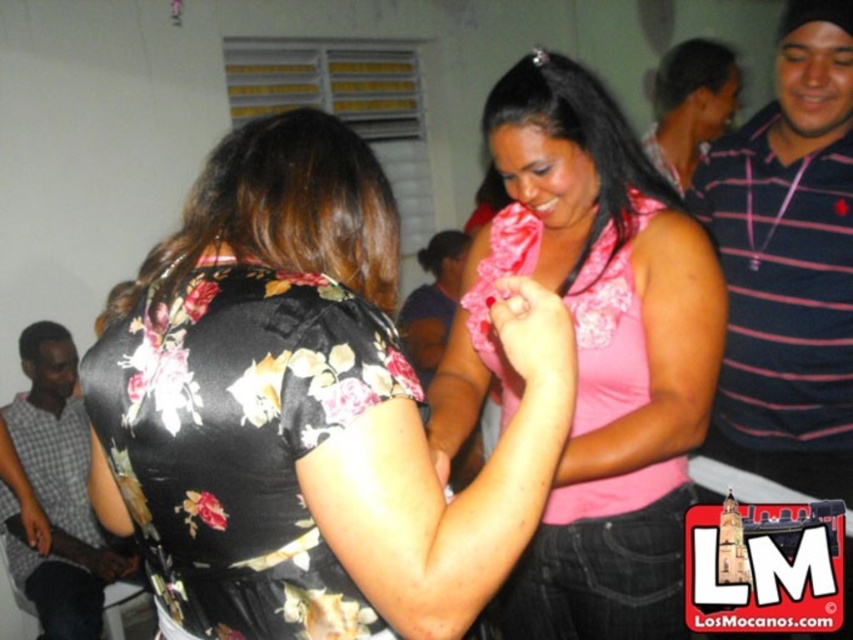
Question: Which point is farther from the camera taking this photo?

Choices:
 (A) (248, 492)
 (B) (848, 540)
 (C) (6, 550)

Answer: (C)

Question: Among these objects, which one is nearest to the camera?

Choices:
 (A) striped cotton shirt at right
 (B) pink satin blouse at center

Answer: (B)

Question: Is striped cotton shirt at right wider than pink satin blouse at upper center?

Choices:
 (A) yes
 (B) no

Answer: (A)

Question: Which object is the farthest from the pink satin blouse at center?

Choices:
 (A) floral satin blouse at center
 (B) striped cotton shirt at right

Answer: (B)

Question: Considering the relative positions of striped polo shirt at upper right and pink satin blouse at upper center in the image provided, where is striped polo shirt at upper right located with respect to pink satin blouse at upper center?

Choices:
 (A) left
 (B) right

Answer: (B)

Question: Is checkered fabric shirt at left further to camera compared to striped polo shirt at upper right?

Choices:
 (A) yes
 (B) no

Answer: (A)